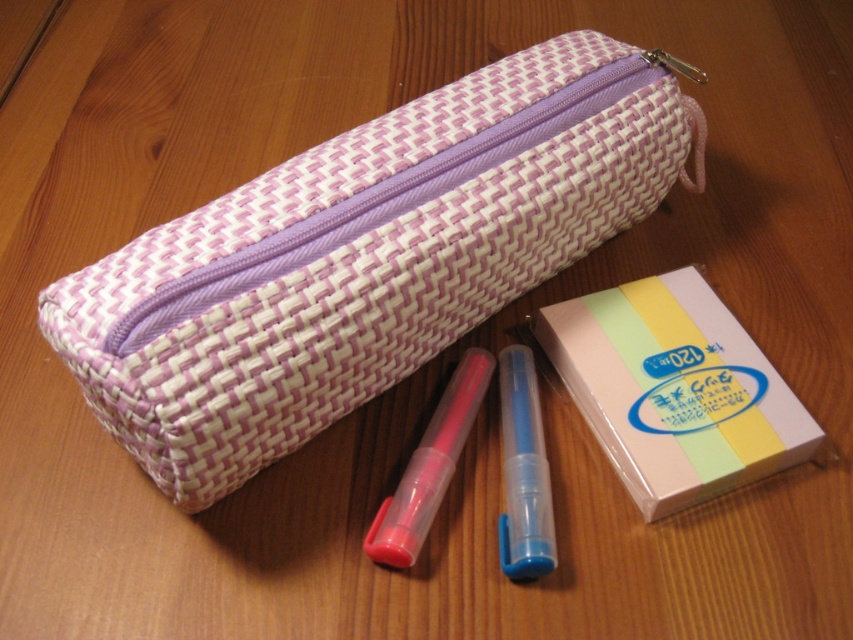
You are organizing stationery items on a desk. You have a pink matte pen at center and a translucent plastic pen at center. If you want to place them in order from left to right, which pen should be placed first?

The pink matte pen at center should be placed first since it is positioned to the left of the translucent plastic pen at center.